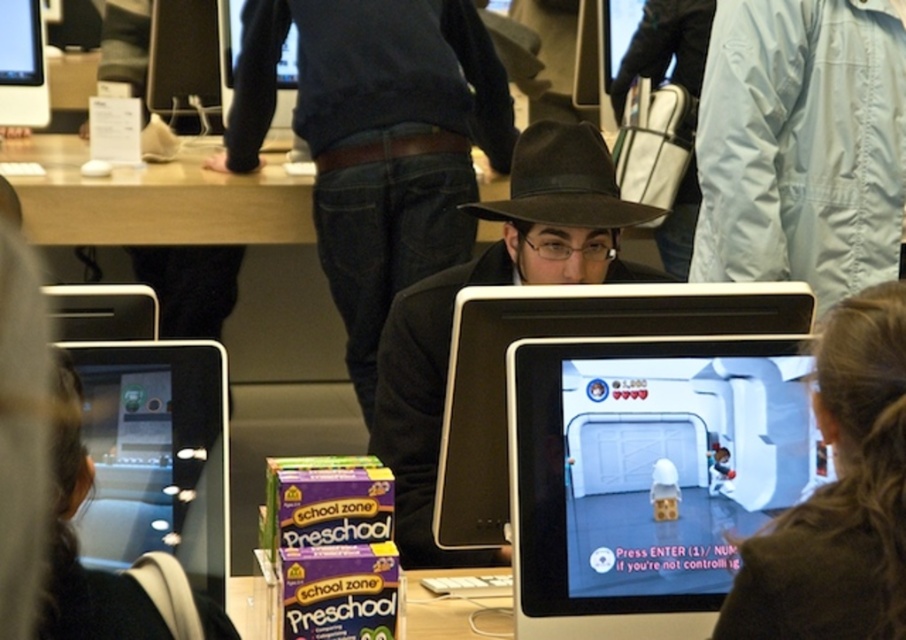
You are a delivery person who needs to place a package between the black glossy tablet at left and the brown felt cowboy hat at center. The package is 2 feet wide. Can you fit it there?

The black glossy tablet at left is 3.38 feet away from the brown felt cowboy hat at center. Since the package is 2 feet wide, it can fit in the space between them as the distance is greater than the package width.

You are a customer in the store looking at the two items displayed on the desk. The items are the dark blue sweater at center and the matte black hat at center. Which item is taller?

The dark blue sweater at center is taller than the matte black hat at center.

You are a customer in the store looking to buy a tablet. You see the matte black tablet at center and the brown felt cowboy hat at center. Which item is smaller in size?

The matte black tablet at center is smaller in size compared to the brown felt cowboy hat at center.